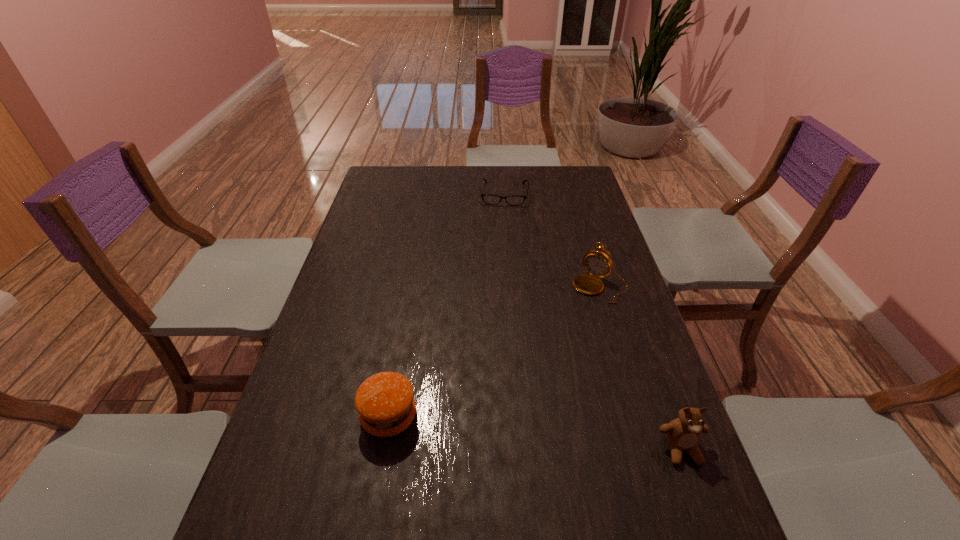
You are a GUI agent. You are given a task and a screenshot of the screen. Output one action in this format:
    pyautogui.click(x=<x>, y=<y>)
    Task: Click on the free space located 0.100m on the face of the second farthest object
    
    Given the screenshot: What is the action you would take?
    click(x=573, y=321)

The width and height of the screenshot is (960, 540). What are the coordinates of `free point located 0.180m on the front-facing side of the spectacles` in the screenshot? It's located at (501, 234).

Image resolution: width=960 pixels, height=540 pixels. I want to click on vacant area situated 0.340m on the front-facing side of the spectacles, so click(499, 262).

Locate an element on the screen. The image size is (960, 540). vacant space located 0.230m on the front-facing side of the spectacles is located at coordinates (501, 242).

This screenshot has height=540, width=960. What are the coordinates of `object situated at the far edge` in the screenshot? It's located at (515, 200).

You are a GUI agent. You are given a task and a screenshot of the screen. Output one action in this format:
    pyautogui.click(x=<x>, y=<y>)
    Task: Click on the teddy bear that is positioned at the right edge
    Image resolution: width=960 pixels, height=540 pixels.
    Given the screenshot: What is the action you would take?
    point(683,434)

You are a GUI agent. You are given a task and a screenshot of the screen. Output one action in this format:
    pyautogui.click(x=<x>, y=<y>)
    Task: Click on the pocket watch that is at the right edge
    The image size is (960, 540).
    Given the screenshot: What is the action you would take?
    pyautogui.click(x=598, y=264)

The width and height of the screenshot is (960, 540). In the image, there is a desktop. Find the location of `vacant space at the far edge`. vacant space at the far edge is located at coordinates (534, 177).

In the image, there is a desktop. Where is `vacant space at the near edge`? vacant space at the near edge is located at coordinates (468, 524).

This screenshot has width=960, height=540. In the image, there is a desktop. What are the coordinates of `vacant space at the left edge` in the screenshot? It's located at (360, 353).